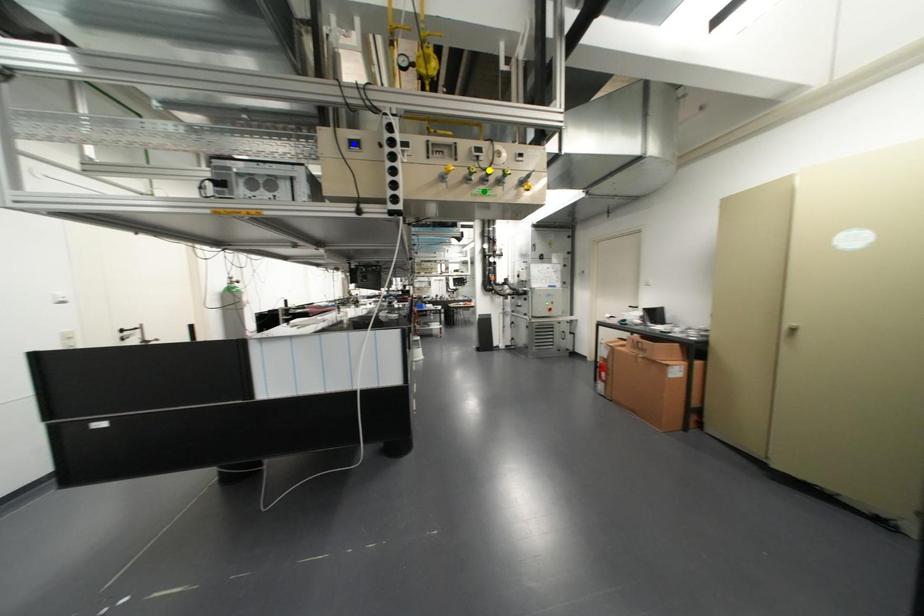
Order these from nearest to farthest:
1. yellow point
2. blue point
3. green point

blue point → yellow point → green point